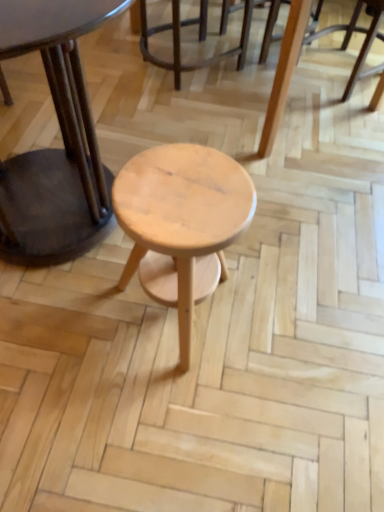
Question: Is light brown wood chair at center smaller than natural wood stool at center?

Choices:
 (A) yes
 (B) no

Answer: (B)

Question: From a real-world perspective, is light brown wood chair at center on top of natural wood stool at center?

Choices:
 (A) yes
 (B) no

Answer: (B)

Question: Is light brown wood chair at center not within natural wood stool at center?

Choices:
 (A) yes
 (B) no

Answer: (A)

Question: Is light brown wood chair at center thinner than natural wood stool at center?

Choices:
 (A) yes
 (B) no

Answer: (B)

Question: Is light brown wood chair at center closer to camera compared to natural wood stool at center?

Choices:
 (A) no
 (B) yes

Answer: (A)

Question: Is natural wood stool at center taller or shorter than matte black table at center?

Choices:
 (A) short
 (B) tall

Answer: (A)

Question: Considering the positions of natural wood stool at center and matte black table at center in the image, is natural wood stool at center wider or thinner than matte black table at center?

Choices:
 (A) wide
 (B) thin

Answer: (B)

Question: From the image's perspective, is natural wood stool at center located above or below matte black table at center?

Choices:
 (A) below
 (B) above

Answer: (A)

Question: Do you think natural wood stool at center is within matte black table at center, or outside of it?

Choices:
 (A) inside
 (B) outside

Answer: (B)

Question: From their relative heights in the image, would you say light brown wood chair at center is taller or shorter than natural wood stool at center?

Choices:
 (A) tall
 (B) short

Answer: (B)

Question: From a real-world perspective, relative to natural wood stool at center, is light brown wood chair at center vertically above or below?

Choices:
 (A) above
 (B) below

Answer: (B)

Question: Relative to natural wood stool at center, is light brown wood chair at center in front or behind?

Choices:
 (A) behind
 (B) front

Answer: (A)

Question: Considering the positions of point (339, 30) and point (215, 237), is point (339, 30) closer or farther from the camera than point (215, 237)?

Choices:
 (A) closer
 (B) farther

Answer: (B)

Question: Would you say matte black table at center is to the left or to the right of light brown wood chair at center in the picture?

Choices:
 (A) right
 (B) left

Answer: (B)

Question: From a real-world perspective, relative to light brown wood chair at center, is matte black table at center vertically above or below?

Choices:
 (A) above
 (B) below

Answer: (A)